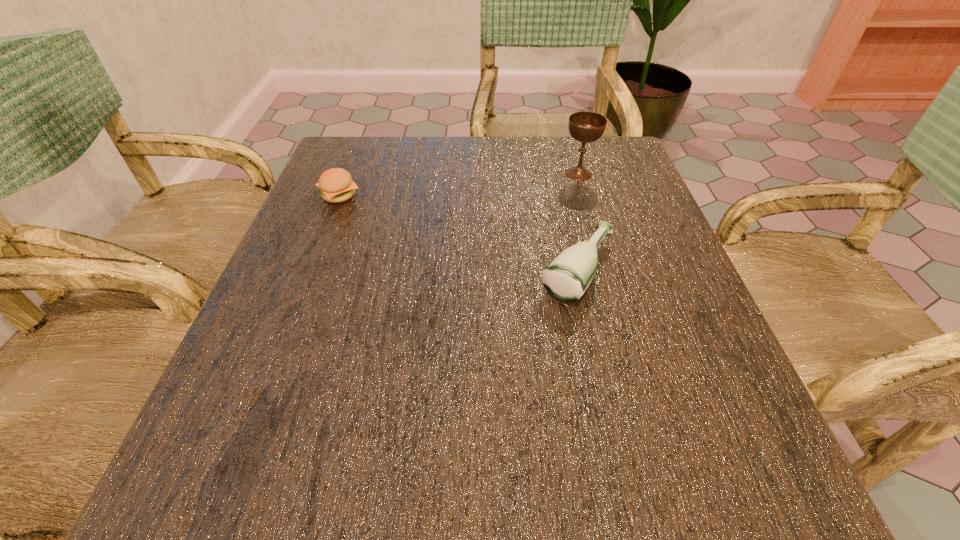
Identify the location of chalice. (584, 126).

This screenshot has width=960, height=540. I want to click on bottle, so click(x=566, y=278).

Find the location of a particular element. the nearest object is located at coordinates (566, 278).

I want to click on hamburger, so click(x=336, y=184).

The width and height of the screenshot is (960, 540). In order to click on the shortest object in this screenshot , I will do `click(336, 184)`.

Where is `free spot located on the left of the tallest object`? Image resolution: width=960 pixels, height=540 pixels. free spot located on the left of the tallest object is located at coordinates (453, 174).

Identify the location of vacant space situated 0.050m on the left of the nearest object. (510, 271).

The image size is (960, 540). I want to click on free region located 0.330m on the front of the shortest object, so click(x=285, y=333).

Where is `chalice at the far edge`? chalice at the far edge is located at coordinates (584, 126).

Identify the location of hamburger present at the far edge. (336, 184).